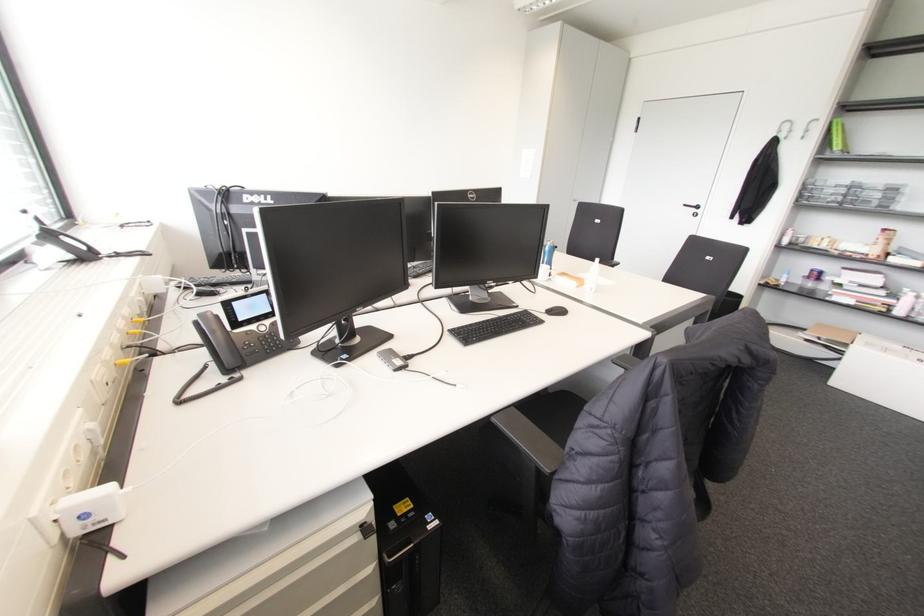
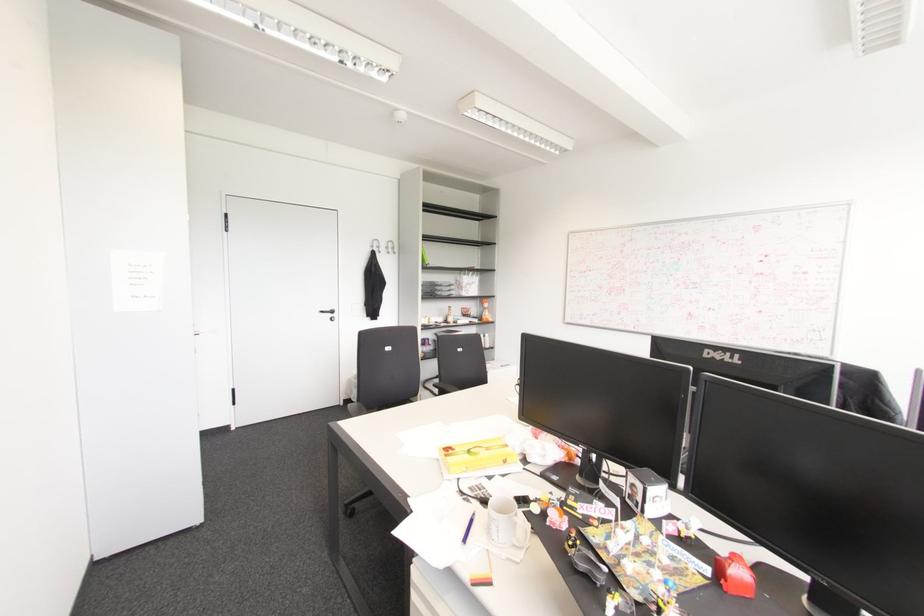
In the second image, find the point that corresponds to (697,207) in the first image.

(332, 310)